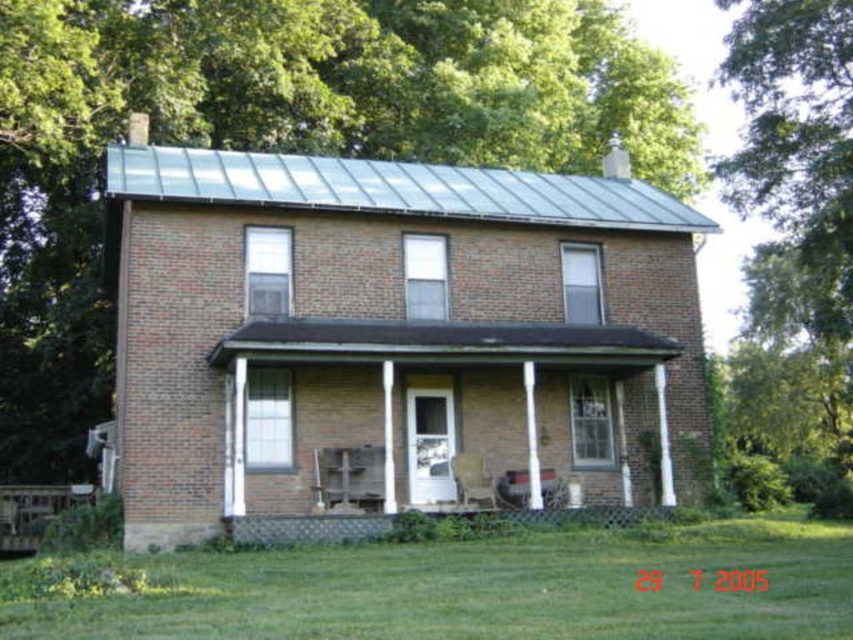
Does green grass at lower center have a lesser height compared to wooden porch at lower center?

Incorrect, green grass at lower center's height does not fall short of wooden porch at lower center's.

Is green grass at lower center below wooden porch at lower center?

Incorrect, green grass at lower center is not positioned below wooden porch at lower center.

In order to click on green grass at lower center in this screenshot , I will do `click(474, 589)`.

You are a GUI agent. You are given a task and a screenshot of the screen. Output one action in this format:
    pyautogui.click(x=<x>, y=<y>)
    Task: Click on the green grass at lower center
    The width and height of the screenshot is (853, 640).
    Given the screenshot: What is the action you would take?
    pyautogui.click(x=474, y=589)

Who is more forward, (390, 4) or (392, 509)?

Point (392, 509)

Who is more distant from viewer, (51, 417) or (392, 509)?

Positioned behind is point (51, 417).

Identify the location of green leafy tree at upper center. This screenshot has width=853, height=640. (279, 138).

Identify the location of green leafy tree at upper center. click(x=279, y=138).

Which is more to the left, green leafy tree at upper center or green grass at lower center?

green leafy tree at upper center

Between green leafy tree at upper center and green grass at lower center, which one has more height?

green leafy tree at upper center is taller.

Which is behind, point (245, 72) or point (775, 525)?

Point (245, 72)

The image size is (853, 640). I want to click on green leafy tree at upper center, so click(x=279, y=138).